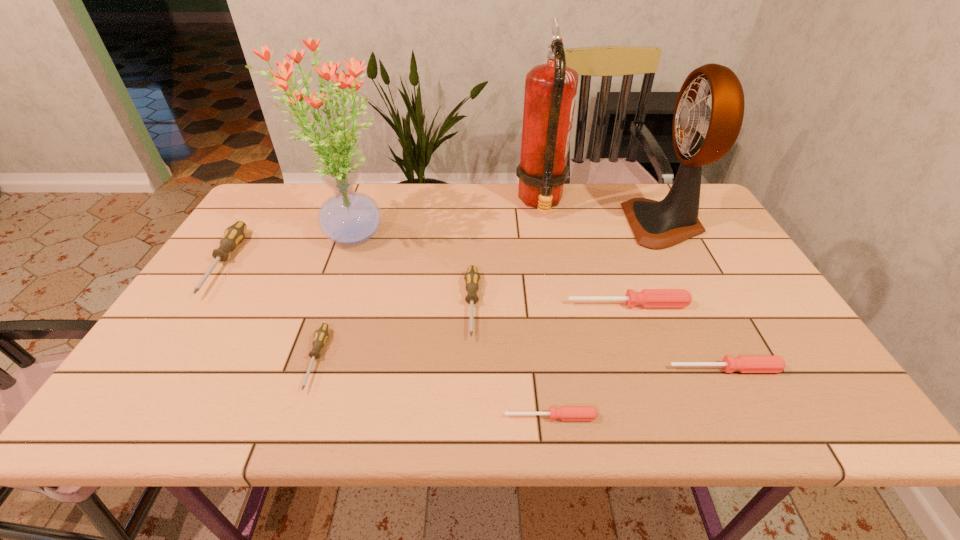
The height and width of the screenshot is (540, 960). In order to click on fire extinguisher in this screenshot , I will do `click(550, 89)`.

What are the coordinates of `flower arrangement` in the screenshot? It's located at (348, 217).

You are a GUI agent. You are given a task and a screenshot of the screen. Output one action in this format:
    pyautogui.click(x=<x>, y=<y>)
    Task: Click on the brown fan
    
    Given the screenshot: What is the action you would take?
    point(702,135)

Locate an element on the screen. The image size is (960, 540). the leftmost screwdriver is located at coordinates (234, 234).

Find the location of `the biggest gray screwdriver`. the biggest gray screwdriver is located at coordinates (234, 234).

Image resolution: width=960 pixels, height=540 pixels. What are the coordinates of `the rightmost gray screwdriver` in the screenshot? It's located at 472,278.

Find the location of a particular element. the fourth screwdriver from right to left is located at coordinates (472, 278).

Find the location of `the farthest red screwdriver`. the farthest red screwdriver is located at coordinates (648, 298).

Where is `the second farthest red screwdriver`? This screenshot has height=540, width=960. the second farthest red screwdriver is located at coordinates (743, 363).

Locate an element on the screen. This screenshot has height=540, width=960. the second screwdriver from left to right is located at coordinates (321, 334).